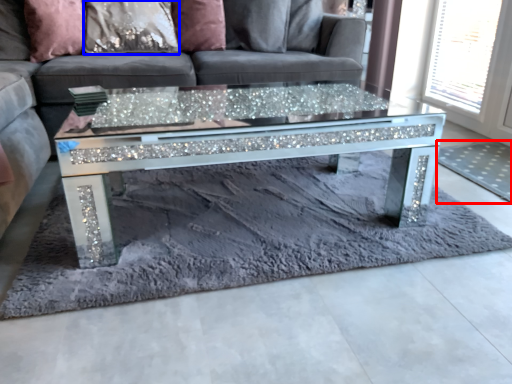
Question: Among these objects, which one is nearest to the camera, mat (highlighted by a red box) or pillow (highlighted by a blue box)?

Choices:
 (A) mat
 (B) pillow

Answer: (A)